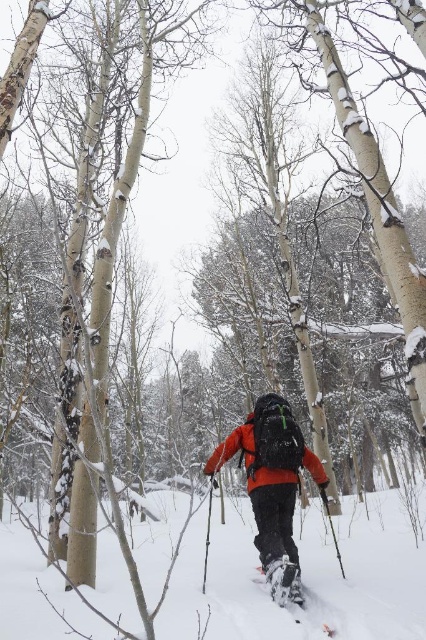
Question: In this image, where is black plastic ski pole at center located relative to white matte ski at lower center?

Choices:
 (A) right
 (B) left

Answer: (B)

Question: Which is farther from the white matte ski at lower center?

Choices:
 (A) orange fleece jacket at center
 (B) white fluffy snow at center
 (C) black textured ski pole at center

Answer: (B)

Question: Which of these objects is positioned closest to the white matte ski at lower center?

Choices:
 (A) white fluffy snow at center
 (B) black plastic ski pole at center
 (C) orange fleece jacket at center

Answer: (C)

Question: Among these objects, which one is nearest to the camera?

Choices:
 (A) white matte ski at lower center
 (B) matte orange jacket at center
 (C) white fluffy snow at center
 (D) black textured ski pole at center

Answer: (C)

Question: Where is white textured snowshoe at center located in relation to black plastic ski pole at center in the image?

Choices:
 (A) above
 (B) below

Answer: (A)

Question: Is matte orange jacket at center bigger than orange fleece jacket at center?

Choices:
 (A) yes
 (B) no

Answer: (A)